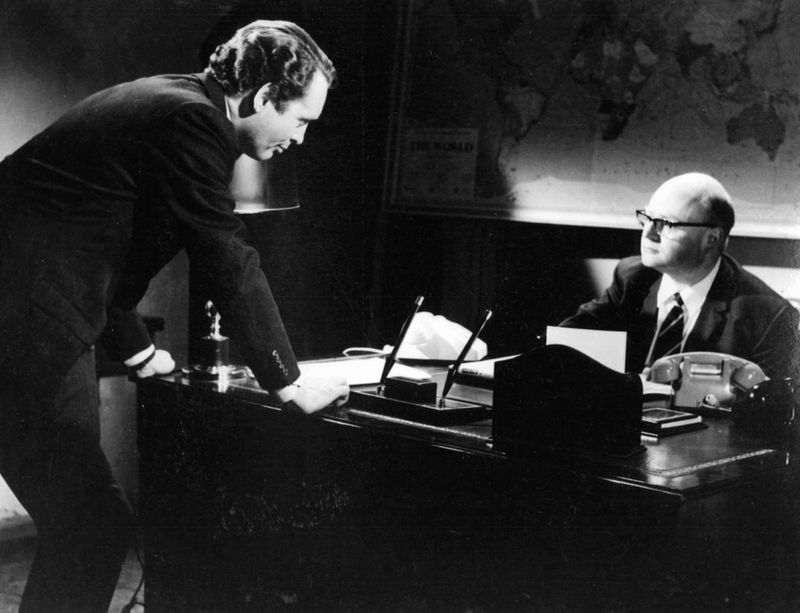
Where is `wall`? Image resolution: width=800 pixels, height=613 pixels. wall is located at coordinates 53,72.